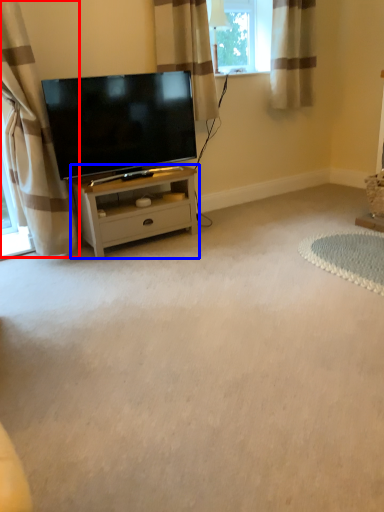
Question: Which object is closer to the camera taking this photo, curtain (highlighted by a red box) or nightstand (highlighted by a blue box)?

Choices:
 (A) curtain
 (B) nightstand

Answer: (A)